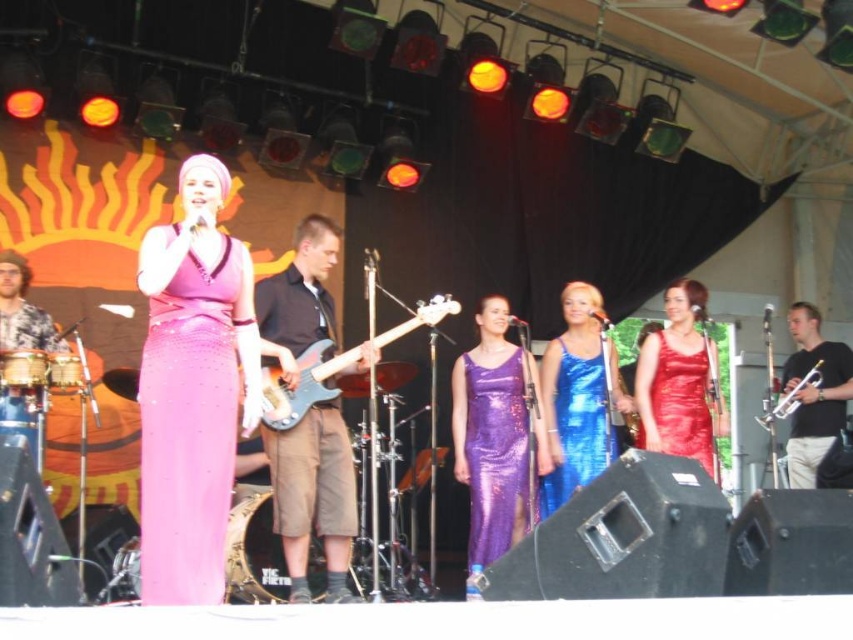
Question: Observing the image, what is the correct spatial positioning of satin shiny dress at left in reference to shiny blue dress at center?

Choices:
 (A) right
 (B) left

Answer: (B)

Question: Which of the following is the farthest from the observer?

Choices:
 (A) (271, 442)
 (B) (708, 460)
 (C) (509, 538)

Answer: (C)

Question: Can you confirm if satin shiny dress at left is smaller than black matte trumpet at right?

Choices:
 (A) no
 (B) yes

Answer: (B)

Question: Can you confirm if shiny blue dress at center is wider than shiny red dress at center?

Choices:
 (A) yes
 (B) no

Answer: (A)

Question: Among these objects, which one is farthest from the camera?

Choices:
 (A) satin shiny dress at left
 (B) dark blue fabric shorts at center
 (C) shiny purple dress at center
 (D) shiny blue dress at center

Answer: (D)

Question: Estimate the real-world distances between objects in this image. Which object is closer to the satin shiny dress at left?

Choices:
 (A) dark blue fabric shorts at center
 (B) shiny blue dress at center

Answer: (A)